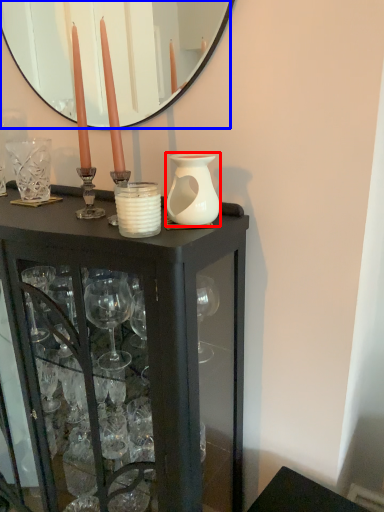
Question: Which object is closer to the camera taking this photo, vase (highlighted by a red box) or mirror (highlighted by a blue box)?

Choices:
 (A) vase
 (B) mirror

Answer: (A)